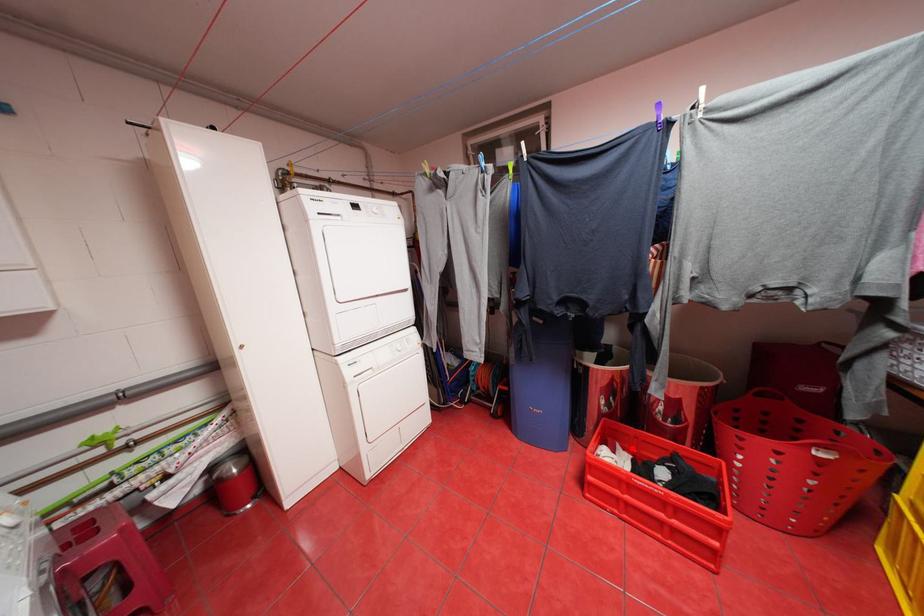
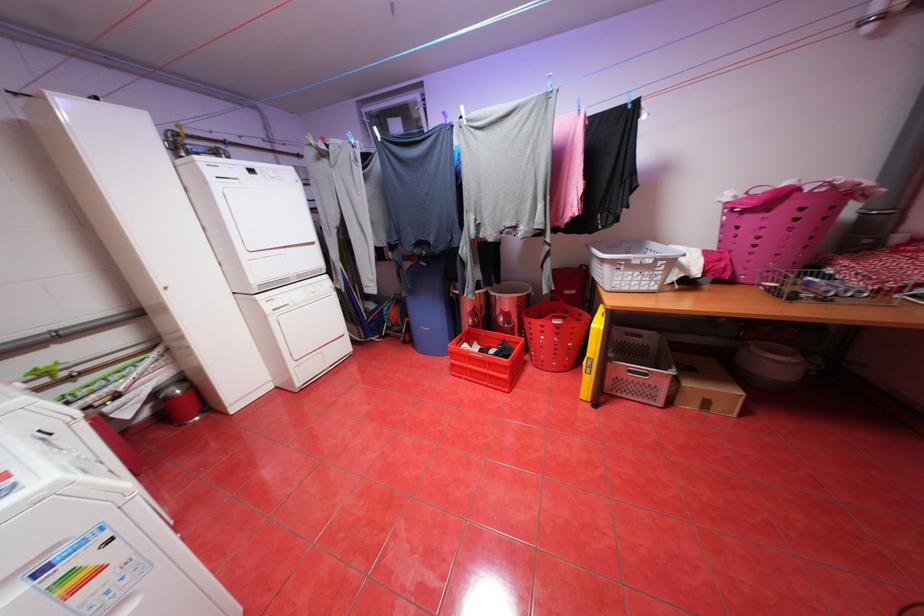
Question: I am providing you with two images of the same scene from different viewpoints. Image1 has a red point marked. In image2, the corresponding 3D location appears at what relative position? Reply with the corresponding letter.

Choices:
 (A) Closer
 (B) Farther

Answer: (A)